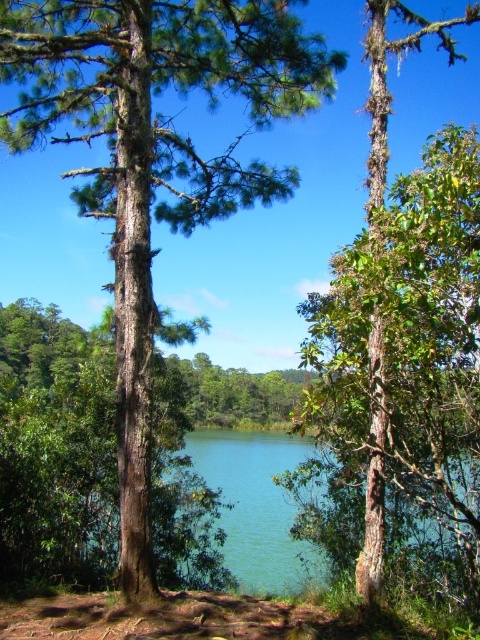
Locate an element on the screen. Image resolution: width=480 pixels, height=640 pixels. brown rough tree at center is located at coordinates (154, 157).

Does brown rough tree at center appear on the left side of green rough bark tree at center?

Correct, you'll find brown rough tree at center to the left of green rough bark tree at center.

Which is behind, point (192, 188) or point (364, 336)?

Positioned behind is point (192, 188).

Find the location of `brown rough tree at center`. brown rough tree at center is located at coordinates (154, 157).